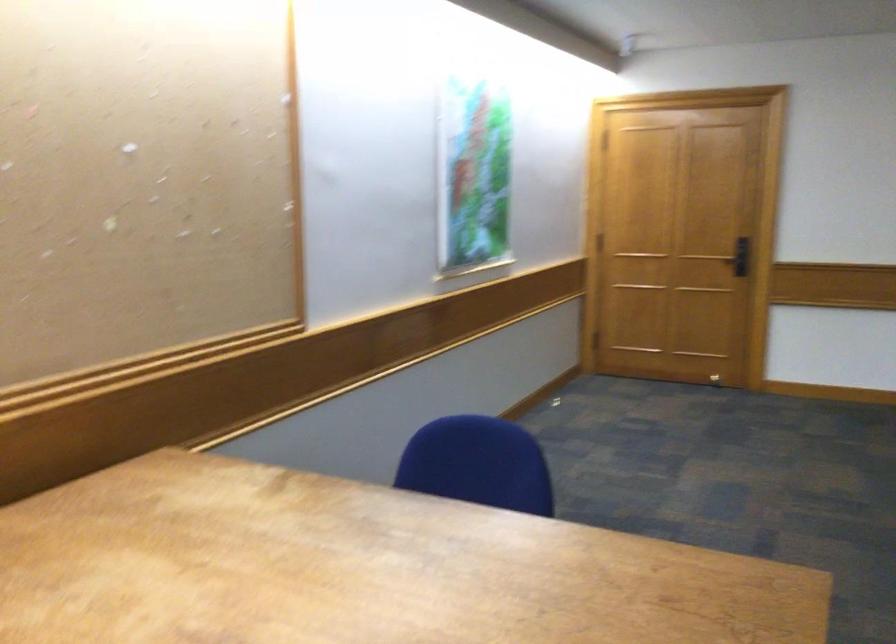
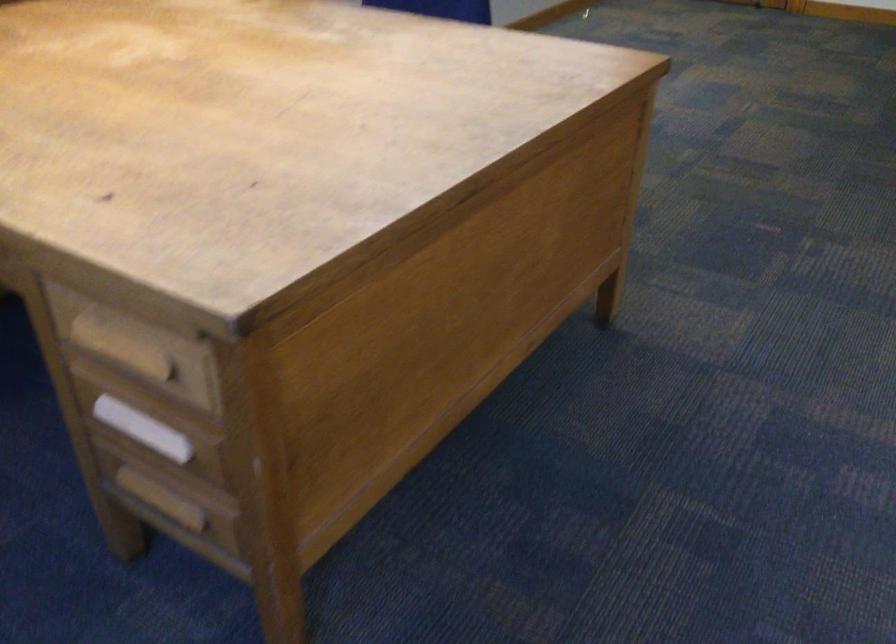
Question: How did the camera likely rotate?

Choices:
 (A) Left
 (B) Right
 (C) Up
 (D) Down

Answer: (D)